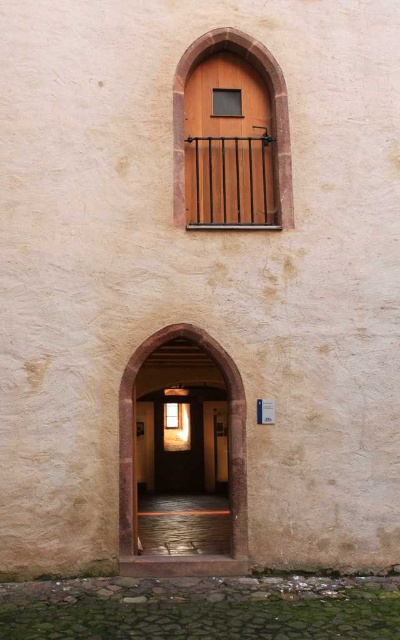
Question: Estimate the real-world distances between objects in this image. Which object is farther from the wooden door at upper center?

Choices:
 (A) smooth stone archway at center
 (B) transparent glass window at upper center

Answer: (B)

Question: Is wooden door at upper center above transparent glass window at upper center?

Choices:
 (A) yes
 (B) no

Answer: (A)

Question: Does wooden door at upper center appear on the left side of transparent glass window at upper center?

Choices:
 (A) yes
 (B) no

Answer: (B)

Question: Considering the real-world distances, which object is farthest from the transparent glass window at upper center?

Choices:
 (A) smooth stone archway at center
 (B) wooden door at upper center

Answer: (B)

Question: Can you confirm if wooden door at upper center is smaller than transparent glass window at upper center?

Choices:
 (A) no
 (B) yes

Answer: (A)

Question: Which object is positioned farthest from the smooth stone archway at center?

Choices:
 (A) wooden door at upper center
 (B) transparent glass window at upper center

Answer: (B)